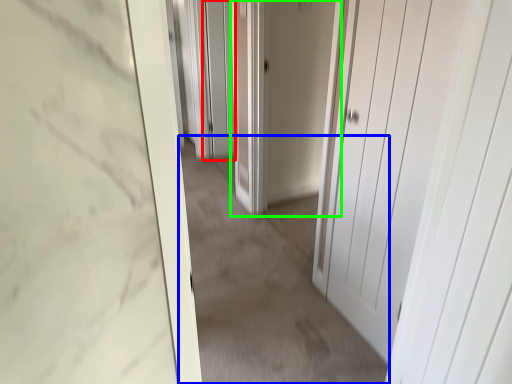
Question: Which object is the farthest from screen door (highlighted by a red box)? Choose among these: plain (highlighted by a blue box) or door (highlighted by a green box).

Choices:
 (A) plain
 (B) door

Answer: (A)